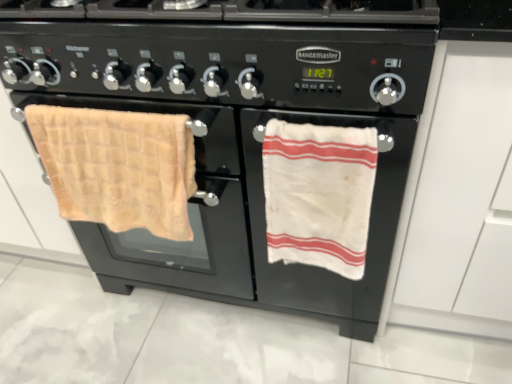
Question: Could white matte drawer at right be considered to be inside black matte gas stove at center?

Choices:
 (A) yes
 (B) no

Answer: (B)

Question: Is black matte gas stove at center not close to white matte drawer at right?

Choices:
 (A) yes
 (B) no

Answer: (B)

Question: Is black matte gas stove at center oriented away from white matte drawer at right?

Choices:
 (A) yes
 (B) no

Answer: (B)

Question: From the image's perspective, is black matte gas stove at center under white matte drawer at right?

Choices:
 (A) no
 (B) yes

Answer: (A)

Question: Does black matte gas stove at center have a smaller size compared to white matte drawer at right?

Choices:
 (A) no
 (B) yes

Answer: (B)

Question: In the image, is white cotton towel at right, which ranks as the 2th beach towel in left-to-right order, positioned in front of or behind white matte drawer at right?

Choices:
 (A) front
 (B) behind

Answer: (B)

Question: Is white cotton towel at right, which is the 1th beach towel from right to left, spatially inside white matte drawer at right, or outside of it?

Choices:
 (A) inside
 (B) outside

Answer: (B)

Question: Is point (328, 206) positioned closer to the camera than point (446, 127)?

Choices:
 (A) closer
 (B) farther

Answer: (B)

Question: Is white cotton towel at right, which is the 1th beach towel from right to left, to the left or to the right of white matte drawer at right in the image?

Choices:
 (A) right
 (B) left

Answer: (B)

Question: Considering their positions, is black matte gas stove at center located in front of or behind beige waffle weave towel at left, positioned as the 2th beach towel in right-to-left order?

Choices:
 (A) behind
 (B) front

Answer: (B)

Question: Considering the positions of black matte gas stove at center and beige waffle weave towel at left, positioned as the 2th beach towel in right-to-left order, in the image, is black matte gas stove at center wider or thinner than beige waffle weave towel at left, positioned as the 2th beach towel in right-to-left order,?

Choices:
 (A) thin
 (B) wide

Answer: (B)

Question: From a real-world perspective, relative to beige waffle weave towel at left, positioned as the 2th beach towel in right-to-left order, is black matte gas stove at center vertically above or below?

Choices:
 (A) above
 (B) below

Answer: (A)

Question: Do you think black matte gas stove at center is within beige waffle weave towel at left, positioned as the 2th beach towel in right-to-left order, or outside of it?

Choices:
 (A) outside
 (B) inside

Answer: (A)

Question: Is white matte drawer at right situated inside beige waffle weave towel at left, positioned as the 2th beach towel in right-to-left order, or outside?

Choices:
 (A) outside
 (B) inside

Answer: (A)

Question: From the image's perspective, relative to beige waffle weave towel at left, positioned as the 2th beach towel in right-to-left order, is white matte drawer at right above or below?

Choices:
 (A) below
 (B) above

Answer: (B)